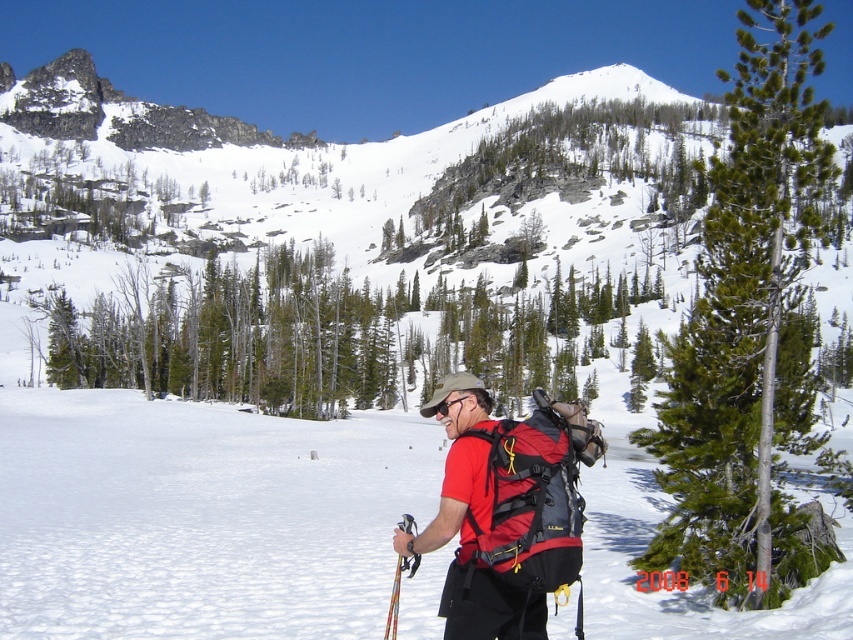
Question: Is the position of green needle-like at center less distant than that of red matte backpack at center?

Choices:
 (A) no
 (B) yes

Answer: (B)

Question: Does green needle-like at center appear on the right side of red matte backpack at center?

Choices:
 (A) no
 (B) yes

Answer: (B)

Question: Among these points, which one is nearest to the camera?

Choices:
 (A) (735, 122)
 (B) (463, 557)

Answer: (B)

Question: Can you confirm if green needle-like at center is smaller than red matte backpack at center?

Choices:
 (A) yes
 (B) no

Answer: (B)